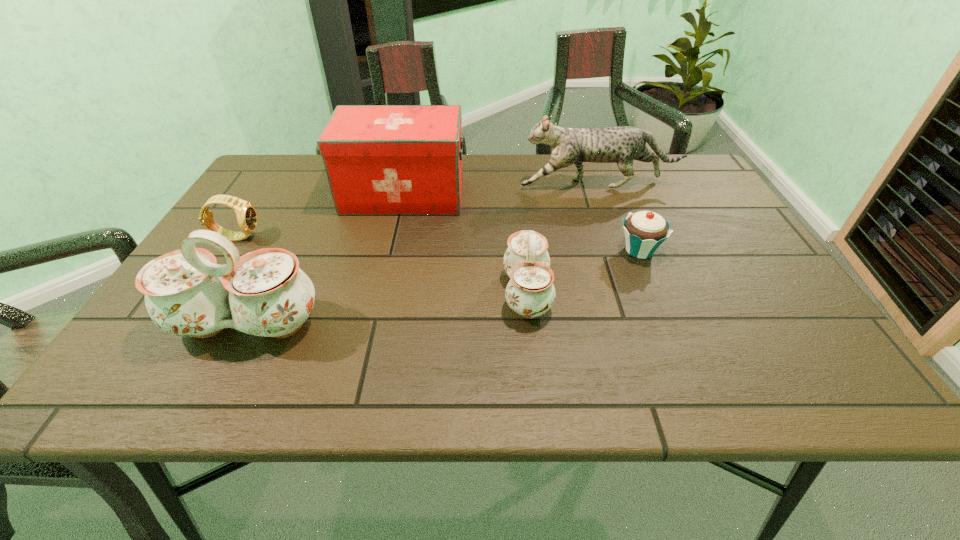
Where is `free space located on the handle side of the first-aid kit`? The image size is (960, 540). free space located on the handle side of the first-aid kit is located at coordinates (504, 195).

At what (x,y) coordinates should I click in order to perform the action: click on free space located on the face of the cat. Please return your answer as a coordinate pair (x, y). This screenshot has height=540, width=960. Looking at the image, I should click on (432, 185).

This screenshot has height=540, width=960. I want to click on blank area located on the face of the cat, so 488,185.

Where is `vacant region located 0.300m on the face of the cat`? Image resolution: width=960 pixels, height=540 pixels. vacant region located 0.300m on the face of the cat is located at coordinates (414, 185).

I want to click on vacant space located on the face of the watch, so click(x=366, y=237).

I want to click on vacant space located on the front of the cupcake, so click(x=656, y=291).

Identify the location of the first-aid kit at the far edge. (379, 159).

Where is `cat that is at the far edge`? Image resolution: width=960 pixels, height=540 pixels. cat that is at the far edge is located at coordinates (623, 144).

The height and width of the screenshot is (540, 960). Identify the location of chinaware located at the left edge. (264, 293).

In order to click on watch that is at the left edge in this screenshot , I will do `click(246, 214)`.